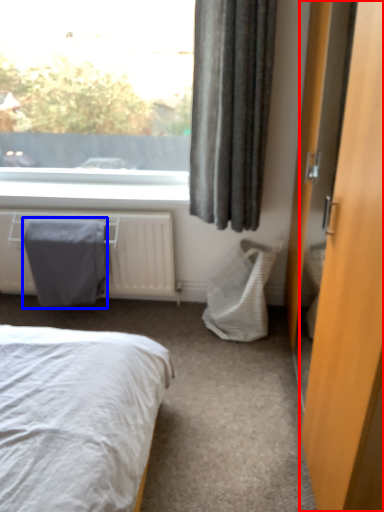
Question: Which object appears closest to the camera in this image, door (highlighted by a red box) or blanket (highlighted by a blue box)?

Choices:
 (A) door
 (B) blanket

Answer: (A)